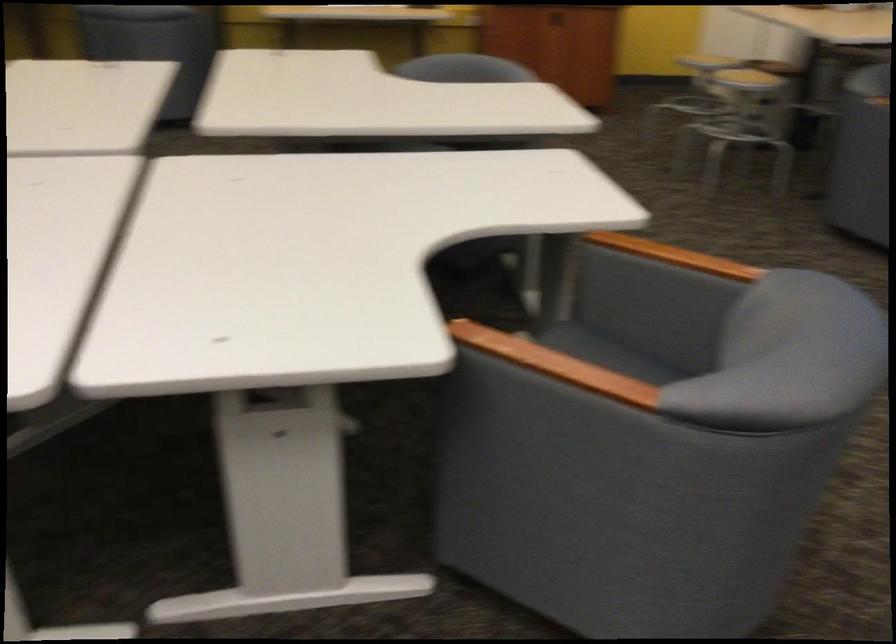
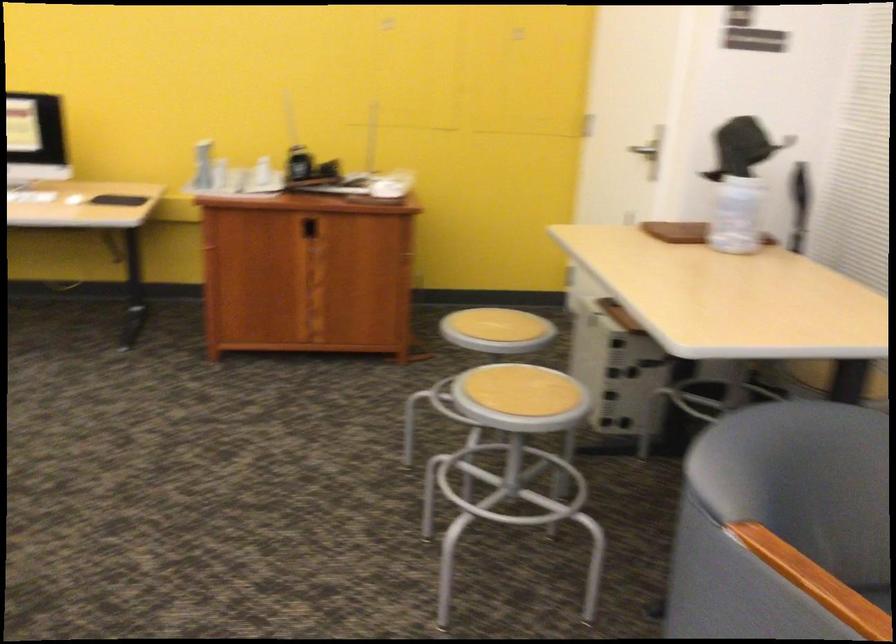
What movement of the cameraman would produce the second image?

The movement direction of the cameraman is right, forward.